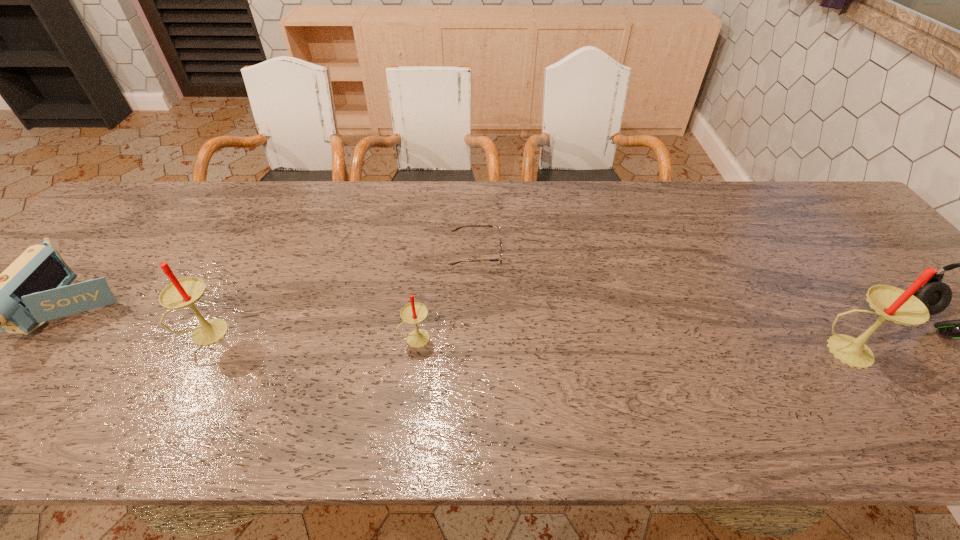
At what (x,y) coordinates should I click in order to perform the action: click on candle that is the second closest to the leftmost object. Please return your answer as a coordinate pair (x, y). The image size is (960, 540). Looking at the image, I should click on (414, 312).

Identify which candle is the closest to the third object from left to right. Please provide its 2D coordinates. Your answer should be formatted as a tuple, i.e. [(x, y)], where the tuple contains the x and y coordinates of a point satisfying the conditions above.

[(184, 292)]

The width and height of the screenshot is (960, 540). I want to click on vacant space that satisfies the following two spatial constraints: 1. on the back side of the rightmost candle; 2. on the front-facing side of the farthest object, so point(778,253).

In order to click on blank space that satisfies the following two spatial constraints: 1. on the front-facing side of the fifth object from left to right; 2. on the left side of the third object from right to left in this screenshot , I will do (x=475, y=351).